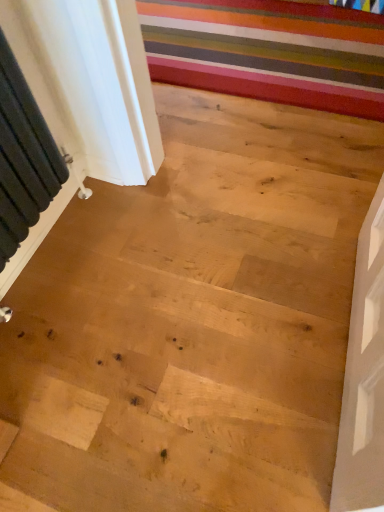
In order to click on dark gray metallic radiator at left in this screenshot , I will do `click(24, 155)`.

What do you see at coordinates (24, 155) in the screenshot?
I see `dark gray metallic radiator at left` at bounding box center [24, 155].

This screenshot has width=384, height=512. In order to click on dark gray metallic radiator at left in this screenshot , I will do `click(24, 155)`.